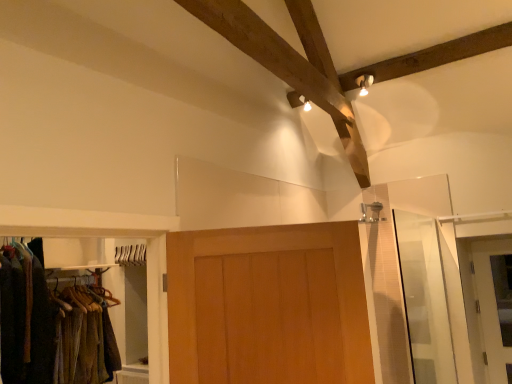
Question: In the image, is white glossy door at right, which is counted as the 1th door, starting from the back, on the left side or the right side of wooden door at center, placed as the first door when sorted from left to right?

Choices:
 (A) right
 (B) left

Answer: (A)

Question: Considering the positions of point (485, 339) and point (238, 327), is point (485, 339) closer or farther from the camera than point (238, 327)?

Choices:
 (A) closer
 (B) farther

Answer: (B)

Question: Considering the real-world distances, which object is closest to the transparent glass screen door at right?

Choices:
 (A) white glossy door at right, positioned as the 2th door in left-to-right order
 (B) wooden door at center, the first door in the front-to-back sequence

Answer: (A)

Question: Which object is the closest to the white glossy door at right, positioned as the 2th door in left-to-right order?

Choices:
 (A) wooden door at center, the 2th door positioned from the right
 (B) transparent glass screen door at right

Answer: (B)